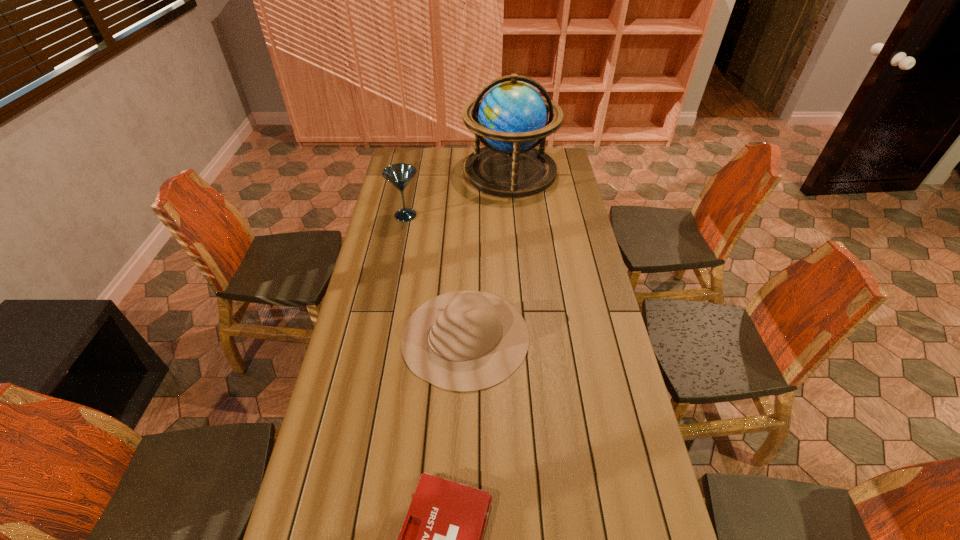
Image resolution: width=960 pixels, height=540 pixels. In order to click on object positioned at the left edge in this screenshot , I will do `click(399, 175)`.

You are a GUI agent. You are given a task and a screenshot of the screen. Output one action in this format:
    pyautogui.click(x=<x>, y=<y>)
    Task: Click on the object situated at the right edge
    Image resolution: width=960 pixels, height=540 pixels.
    Given the screenshot: What is the action you would take?
    pyautogui.click(x=512, y=116)

Where is `object at the far right corner`? Image resolution: width=960 pixels, height=540 pixels. object at the far right corner is located at coordinates (512, 116).

You are a GUI agent. You are given a task and a screenshot of the screen. Output one action in this format:
    pyautogui.click(x=<x>, y=<y>)
    Task: Click on the free point at the far edge
    The image size is (960, 540).
    Given the screenshot: What is the action you would take?
    pyautogui.click(x=443, y=155)

You are a GUI agent. You are given a task and a screenshot of the screen. Output one action in this format:
    pyautogui.click(x=<x>, y=<y>)
    Task: Click on the free spot at the left edge of the desktop
    The width and height of the screenshot is (960, 540).
    Given the screenshot: What is the action you would take?
    pyautogui.click(x=323, y=495)

Image resolution: width=960 pixels, height=540 pixels. In the image, there is a desktop. Find the location of `vacant region at the right edge`. vacant region at the right edge is located at coordinates (567, 195).

Locate an element on the screen. free spot at the far left corner of the desktop is located at coordinates (419, 153).

Find the location of `blank region between the second shortest object and the martini`. blank region between the second shortest object and the martini is located at coordinates (436, 276).

Identify the location of empty location between the second shortest object and the globe. The width and height of the screenshot is (960, 540). (488, 254).

Where is `unoccupied area between the second shortest object and the third nearest object`? The width and height of the screenshot is (960, 540). unoccupied area between the second shortest object and the third nearest object is located at coordinates (436, 276).